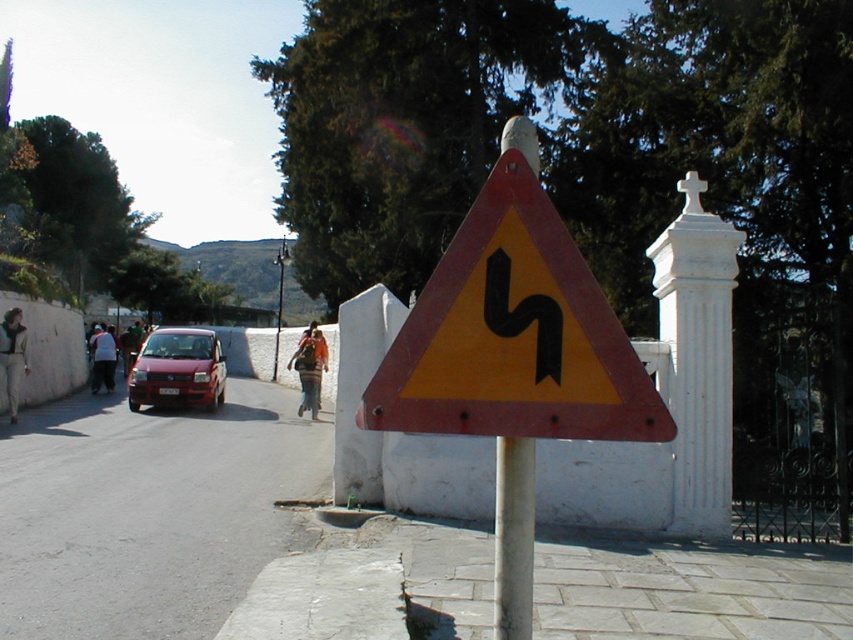
You are a pedestrian standing on the sidewalk and want to cross the street to reach the gray concrete curb at lower left. Is the shiny red car at center blocking your path?

The gray concrete curb at lower left is closer to the viewer than the shiny red car at center, so the shiny red car at center is behind the curb and not blocking your path.

You are a driver approaching the sharp curve ahead. You see the metallic yellow triangle at center and the shiny red car at center. Which object is narrower in width?

The metallic yellow triangle at center is thinner than the shiny red car at center, so the metallic yellow triangle at center is narrower in width.

You are a delivery driver who needs to locate the road sign indicating a sharp curve ahead. According to the image, where exactly is the metallic yellow triangle at center positioned?

The metallic yellow triangle at center is positioned at point [514,336].